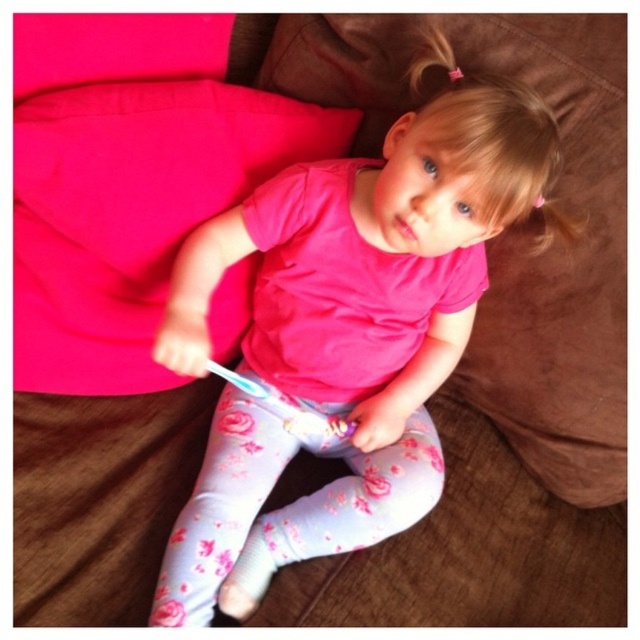
Who is more forward, (320, 512) or (252, 380)?

Point (320, 512)

Between pink matte shirt at center and white plastic toothbrush at lower center, which one has more height?

pink matte shirt at center

The width and height of the screenshot is (640, 640). What do you see at coordinates (346, 330) in the screenshot? I see `pink matte shirt at center` at bounding box center [346, 330].

I want to click on pink matte shirt at center, so click(346, 330).

Which is more to the left, pink fabric pillow at upper left or white plastic toothbrush at lower center?

Positioned to the left is pink fabric pillow at upper left.

Does point (150, 172) lie behind point (273, 397)?

That is False.

Find the location of a particular element. pink fabric pillow at upper left is located at coordinates (131, 212).

Is pink matte shirt at center shorter than pink fabric pillow at upper left?

Incorrect, pink matte shirt at center's height does not fall short of pink fabric pillow at upper left's.

Based on the photo, does pink matte shirt at center appear on the right side of pink fabric pillow at upper left?

Correct, you'll find pink matte shirt at center to the right of pink fabric pillow at upper left.

Is point (490, 173) positioned after point (256, 93)?

No, it is not.

The width and height of the screenshot is (640, 640). What are the coordinates of `pink matte shirt at center` in the screenshot? It's located at (346, 330).